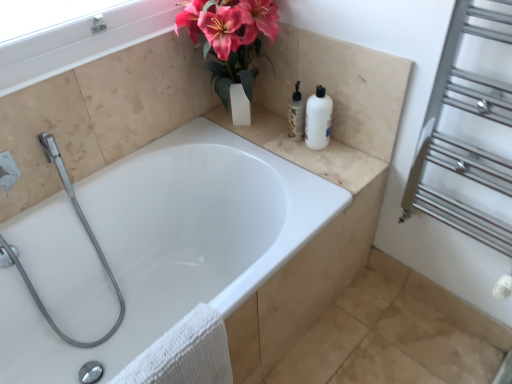
This screenshot has width=512, height=384. Describe the element at coordinates (184, 353) in the screenshot. I see `white textured towel at lower left` at that location.

Find the location of a particular element. This screenshot has height=384, width=512. white glossy bottle at upper center is located at coordinates (296, 116).

Image resolution: width=512 pixels, height=384 pixels. Describe the element at coordinates (173, 243) in the screenshot. I see `white glossy bathtub at center` at that location.

Measure the distance between white plastic bottle at upper right and camera.

The distance of white plastic bottle at upper right from camera is 1.40 meters.

Describe the element at coordinates (470, 129) in the screenshot. I see `silver metallic towel rack at right` at that location.

What is the approximate width of silver metallic towel rack at right?

It is 8.06 inches.

This screenshot has width=512, height=384. Find the location of `white textured towel at lower left`. white textured towel at lower left is located at coordinates (184, 353).

Looking at this image, what's the angular difference between white textured towel at lower left and white plastic bottle at upper right's facing directions?

89.1 degrees separate the facing orientations of white textured towel at lower left and white plastic bottle at upper right.

Based on the photo, is white textured towel at lower left far away from white plastic bottle at upper right?

No, white textured towel at lower left is in close proximity to white plastic bottle at upper right.

In the scene shown: From the image's perspective, is white textured towel at lower left below white plastic bottle at upper right?

Yes, from the image's perspective, white textured towel at lower left is below white plastic bottle at upper right.

Identify the location of bath towel below the white plastic bottle at upper right (from the image's perspective). The image size is (512, 384). (184, 353).

Is white glossy bathtub at center positioned before silver metallic towel rack at right?

No, it is not.

Which point is more distant from viewer, (261, 159) or (472, 174)?

Positioned behind is point (261, 159).

Is white glossy bathtub at center positioned with its back to silver metallic towel rack at right?

No, white glossy bathtub at center is not facing away from silver metallic towel rack at right.

How different are the orientations of white glossy bathtub at center and silver metallic towel rack at right in degrees?

The facing directions of white glossy bathtub at center and silver metallic towel rack at right are 89 degrees apart.

From a real-world perspective, relative to white textured towel at lower left, is white plastic bottle at upper right vertically above or below?

white plastic bottle at upper right is situated higher than white textured towel at lower left in the real world.

Is white plastic bottle at upper right bigger or smaller than white textured towel at lower left?

Considering their sizes, white plastic bottle at upper right takes up less space than white textured towel at lower left.

Are white plastic bottle at upper right and white textured towel at lower left located far from each other?

No, white plastic bottle at upper right is not far from white textured towel at lower left.

Does white plastic bottle at upper right have a greater width compared to white textured towel at lower left?

No.

Does point (405, 194) lie in front of point (190, 309)?

Yes.

Could you tell me if silver metallic towel rack at right is turned towards white glossy bathtub at center?

No.

Is silver metallic towel rack at right located outside white glossy bathtub at center?

Yes, silver metallic towel rack at right is not within white glossy bathtub at center.

Is white textured towel at lower left inside or outside of white glossy bathtub at center?

The correct answer is: inside.

This screenshot has width=512, height=384. Find the location of `bath towel that appears behind the white glossy bathtub at center`. bath towel that appears behind the white glossy bathtub at center is located at coordinates (184, 353).

Considering the sizes of white textured towel at lower left and white glossy bathtub at center in the image, is white textured towel at lower left wider or thinner than white glossy bathtub at center?

In the image, white textured towel at lower left appears to be more narrow than white glossy bathtub at center.

Is white textured towel at lower left placed right next to white glossy bathtub at center?

They are not placed beside each other.

Is silver metallic towel rack at right spatially inside white textured towel at lower left, or outside of it?

silver metallic towel rack at right exists outside the volume of white textured towel at lower left.

From a real-world perspective, is silver metallic towel rack at right physically located above or below white textured towel at lower left?

silver metallic towel rack at right is above white textured towel at lower left.

Are silver metallic towel rack at right and white textured towel at lower left located far from each other?

silver metallic towel rack at right is near white textured towel at lower left, not far away.

What's the angular difference between silver metallic towel rack at right and white textured towel at lower left's facing directions?

89.9 degrees.

From a real-world perspective, between white glossy bottle at upper center and white textured towel at lower left, who is vertically higher?

In real-world perspective, white glossy bottle at upper center is above.

Is white glossy bottle at upper center not close to white textured towel at lower left?

white glossy bottle at upper center is actually quite close to white textured towel at lower left.

Who is bigger, white glossy bottle at upper center or white textured towel at lower left?

white textured towel at lower left is bigger.

Is point (298, 126) positioned behind point (209, 346)?

Yes, it is.

Locate an element on the screen. This screenshot has width=512, height=384. bath towel below the white plastic bottle at upper right (from a real-world perspective) is located at coordinates [x=184, y=353].

I want to click on bathtub below the silver metallic towel rack at right (from the image's perspective), so click(x=173, y=243).

Looking at the image, which one is located closer to white glossy bottle at upper center, white plastic bottle at upper right or beige marble counter top at upper right?

white plastic bottle at upper right lies closer to white glossy bottle at upper center than the other object.

Which object lies further to the anchor point white plastic bottle at upper right, beige marble counter top at upper right or white glossy bathtub at center?

white glossy bathtub at center is further to white plastic bottle at upper right.

Consider the image. Considering their positions, is white glossy bathtub at center positioned closer to white textured towel at lower left than beige marble counter top at upper right?

Among the two, white glossy bathtub at center is located nearer to white textured towel at lower left.

When comparing their distances from white textured towel at lower left, does white plastic bottle at upper right or silver metallic towel rack at right seem further?

silver metallic towel rack at right lies further to white textured towel at lower left than the other object.

From the image, which object appears to be nearer to white glossy bathtub at center, white plastic bottle at upper right or white textured towel at lower left?

white textured towel at lower left lies closer to white glossy bathtub at center than the other object.

When comparing their distances from white plastic bottle at upper right, does white glossy bottle at upper center or silver metallic towel rack at right seem closer?

The object closer to white plastic bottle at upper right is white glossy bottle at upper center.

Considering their positions, is beige marble counter top at upper right positioned further to silver metallic towel rack at right than white textured towel at lower left?

white textured towel at lower left lies further to silver metallic towel rack at right than the other object.

From the image, which object appears to be nearer to white glossy bathtub at center, white glossy bottle at upper center or silver metallic towel rack at right?

white glossy bottle at upper center lies closer to white glossy bathtub at center than the other object.

At what (x,y) coordinates should I click in order to perform the action: click on bathtub between white plastic bottle at upper right and white textured towel at lower left from top to bottom. Please return your answer as a coordinate pair (x, y). This screenshot has height=384, width=512. Looking at the image, I should click on (173, 243).

The image size is (512, 384). I want to click on bath towel between white glossy bathtub at center and silver metallic towel rack at right in the horizontal direction, so point(184,353).

This screenshot has width=512, height=384. I want to click on toiletry between beige marble counter top at upper right and white plastic bottle at upper right from left to right, so click(296, 116).

You are a GUI agent. You are given a task and a screenshot of the screen. Output one action in this format:
    pyautogui.click(x=<x>, y=<y>)
    Task: Click on the bathtub between beige marble counter top at upper right and white textured towel at lower left from top to bottom
    
    Given the screenshot: What is the action you would take?
    pyautogui.click(x=173, y=243)